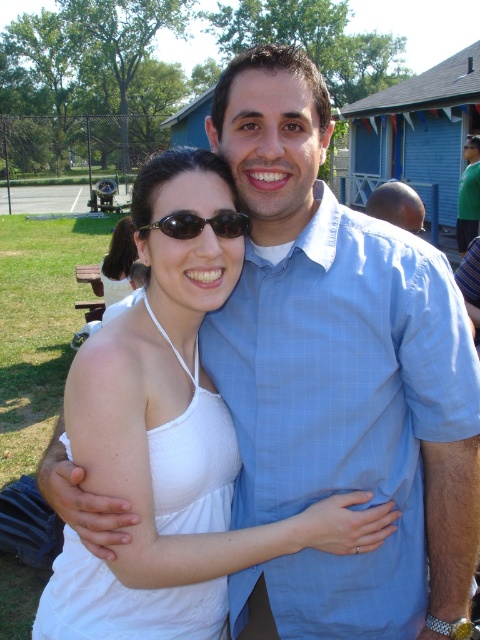
You are a photographer at this event and need to adjust the camera focus. Which person should you focus on first if you want to capture both the smooth bald head at center and the green fabric shirt at right in sharp focus?

The smooth bald head at center is shorter than the green fabric shirt at right, so you should focus on the green fabric shirt at right first to ensure both are in sharp focus.

Looking at the scene described, which object is positioned to the left of the other between the smooth bald head at center and the black plastic goggles at upper center?

The black plastic goggles at upper center are positioned to the left of the smooth bald head at center.

You are a photographer standing in front of the smooth bald head at center. You want to take a closeup photo of it. The minimum focusing distance of your camera is 2.8 meters. Can you take the photo without moving closer?

The smooth bald head at center and viewer are 2.90 meters apart from each other. Since the minimum focusing distance is 2.8 meters, the photographer needs to move 0.1 meters closer to achieve focus.